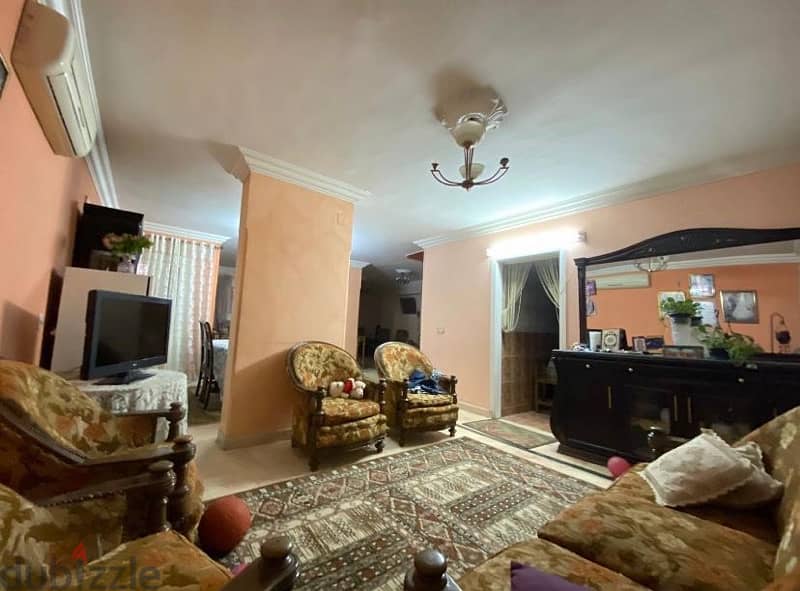
At what (x,y) coordinates should I click in order to perform the action: click on couch. Please return your answer as a coordinate pair (x, y). The height and width of the screenshot is (591, 800). Looking at the image, I should click on click(x=733, y=552).